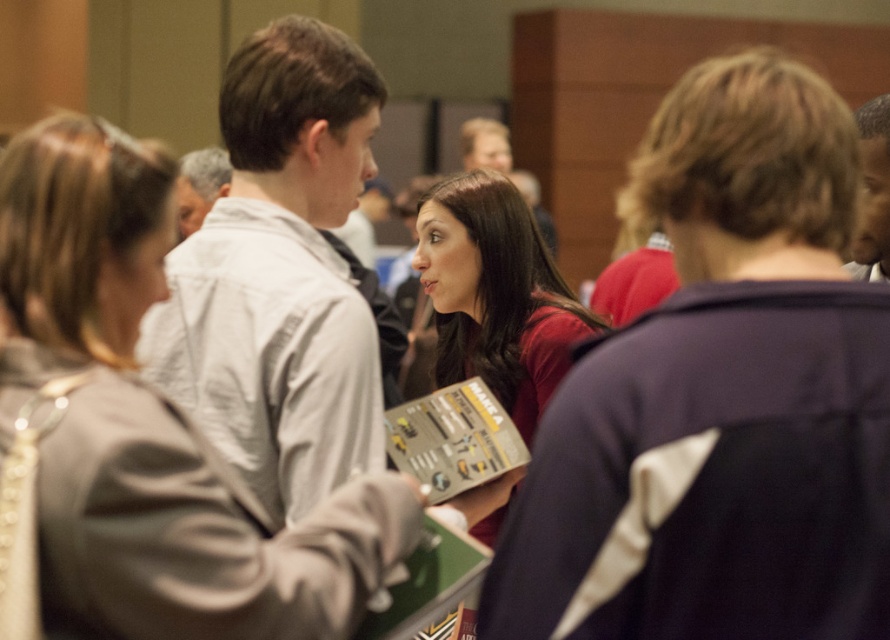
Question: Is dark blue jacket at center wider than matte gray hoodie at center?

Choices:
 (A) no
 (B) yes

Answer: (A)

Question: Does matte gray hoodie at center appear on the right side of dark brown hair at upper right?

Choices:
 (A) no
 (B) yes

Answer: (A)

Question: Which object is the farthest from the matte red shirt at center?

Choices:
 (A) light gray jacket at center
 (B) dark brown hair at upper right
 (C) dark blue jacket at center

Answer: (C)

Question: Can you confirm if matte gray hoodie at center is wider than white fabric jacket at center?

Choices:
 (A) no
 (B) yes

Answer: (B)

Question: Which of these objects is positioned farthest from the dark blue jacket at center?

Choices:
 (A) white fabric jacket at center
 (B) light gray jacket at center

Answer: (B)

Question: Which point is farther to the camera?

Choices:
 (A) (767, 65)
 (B) (854, 252)
 (C) (423, 218)
 (D) (197, 204)

Answer: (D)